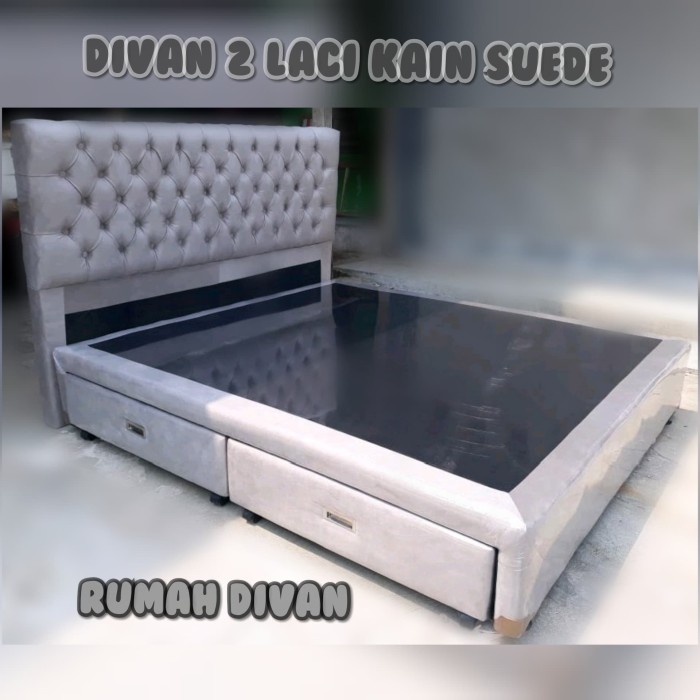
Where is `white carpet`? white carpet is located at coordinates (102, 526).